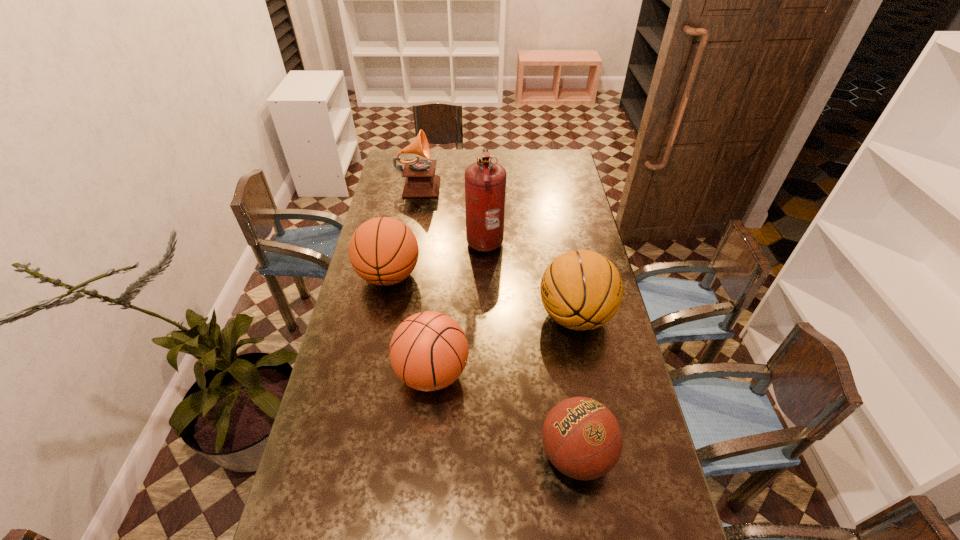
Identify the location of object that ranks as the closest to the shortest object. This screenshot has width=960, height=540. (429, 350).

Select which basketball appears as the second closest to the farthest object. Please provide its 2D coordinates. Your answer should be formatted as a tuple, i.e. [(x, y)], where the tuple contains the x and y coordinates of a point satisfying the conditions above.

[(581, 290)]

Where is `basketball that is the fourth closest to the fire extinguisher`? The image size is (960, 540). basketball that is the fourth closest to the fire extinguisher is located at coordinates (582, 438).